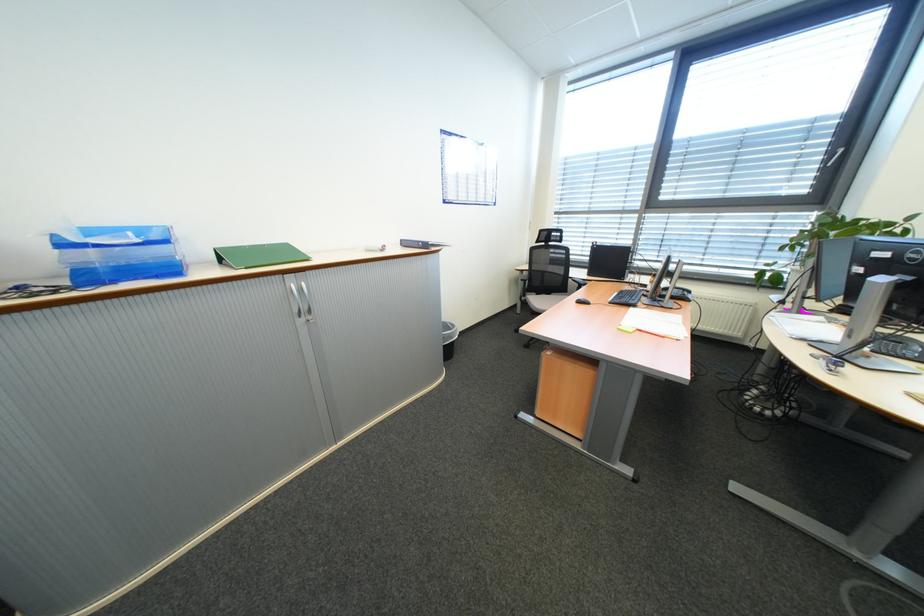
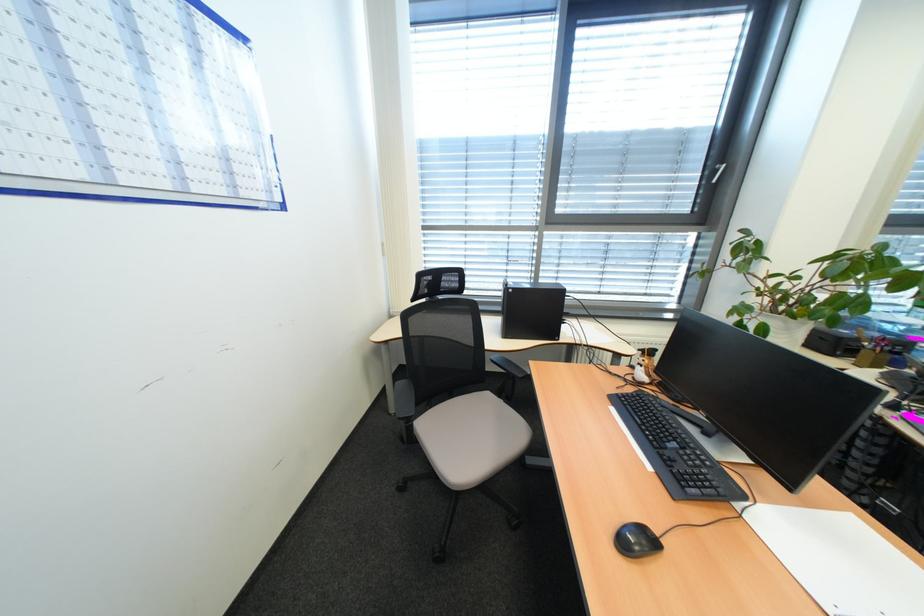
In the second image, find the point that corresponds to (x=582, y=282) in the first image.

(503, 362)